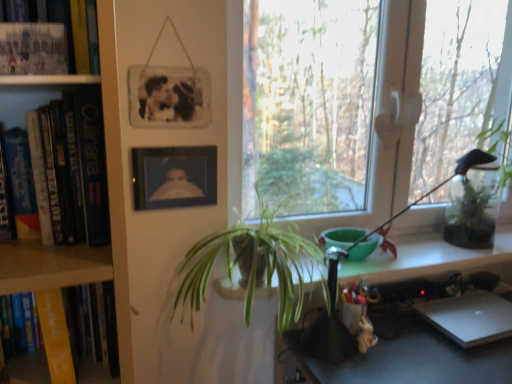
What do you see at coordinates (337, 105) in the screenshot? The width and height of the screenshot is (512, 384). I see `transparent glass window at center` at bounding box center [337, 105].

The width and height of the screenshot is (512, 384). Describe the element at coordinates (70, 28) in the screenshot. I see `matte paper book at upper left, the 1th book in the top-to-bottom sequence` at that location.

Where is `matte paper book at upper left, the 1th book in the top-to-bottom sequence`? The height and width of the screenshot is (384, 512). matte paper book at upper left, the 1th book in the top-to-bottom sequence is located at coordinates (70, 28).

Measure the distance between point (480, 299) and camera.

Point (480, 299) and camera are 5.21 feet apart.

The height and width of the screenshot is (384, 512). What are the coordinates of `green leafy plant at center, positioned as the second houseplant in right-to-left order` in the screenshot? It's located at (252, 264).

In terms of height, does matte black photo frame at upper left, which is counted as the second book, starting from the top, look taller or shorter compared to silver metallic laptop at lower right?

In the image, matte black photo frame at upper left, which is counted as the second book, starting from the top, appears to be taller than silver metallic laptop at lower right.

Considering the sizes of matte black photo frame at upper left, which is counted as the second book, starting from the top, and silver metallic laptop at lower right in the image, is matte black photo frame at upper left, which is counted as the second book, starting from the top, bigger or smaller than silver metallic laptop at lower right?

Clearly, matte black photo frame at upper left, which is counted as the second book, starting from the top, is smaller in size than silver metallic laptop at lower right.

Is matte black photo frame at upper left, which is counted as the second book, starting from the top, wider or thinner than silver metallic laptop at lower right?

Considering their sizes, matte black photo frame at upper left, which is counted as the second book, starting from the top, looks slimmer than silver metallic laptop at lower right.

From the image's perspective, between transparent glass window at center and yellow paperback book at left, the 4th book when ordered from top to bottom, who is located below?

From the image's view, yellow paperback book at left, the 4th book when ordered from top to bottom, is below.

How distant is transparent glass window at center from yellow paperback book at left, the 4th book when ordered from top to bottom?

10.91 feet.

Identify the location of book that is the 3rd one when counting downward from the transparent glass window at center (from the image's perspective). Image resolution: width=512 pixels, height=384 pixels. (81, 347).

Is transparent glass window at center in front of yellow paperback book at left, the 4th book when ordered from top to bottom?

That is False.

In the scene shown: Which object is more forward, matte black photo frame at upper left, which is counted as the second book, starting from the top, or matte black picture frame at upper center, which ranks as the first picture frame in bottom-to-top order?

matte black photo frame at upper left, which is counted as the second book, starting from the top, is in front.

Considering the relative positions of matte black photo frame at upper left, which is counted as the second book, starting from the top, and matte black picture frame at upper center, which is the 2th picture frame in top-to-bottom order, in the image provided, is matte black photo frame at upper left, which is counted as the second book, starting from the top, to the right of matte black picture frame at upper center, which is the 2th picture frame in top-to-bottom order, from the viewer's perspective?

No, matte black photo frame at upper left, which is counted as the second book, starting from the top, is not to the right of matte black picture frame at upper center, which is the 2th picture frame in top-to-bottom order.

How distant is matte black photo frame at upper left, acting as the third book starting from the bottom, from matte black picture frame at upper center, which is the 2th picture frame in top-to-bottom order?

matte black photo frame at upper left, acting as the third book starting from the bottom, is 17.99 inches away from matte black picture frame at upper center, which is the 2th picture frame in top-to-bottom order.

Is point (19, 27) closer to viewer compared to point (189, 192)?

Yes, point (19, 27) is in front of point (189, 192).

Is matte black picture frame at upper center, which ranks as the first picture frame in bottom-to-top order, completely or partially outside of matte black photo frame at upper left, which is counted as the second book, starting from the top?

matte black picture frame at upper center, which ranks as the first picture frame in bottom-to-top order, lies outside matte black photo frame at upper left, which is counted as the second book, starting from the top,'s area.

Is matte black picture frame at upper center, which is the 2th picture frame in top-to-bottom order, bigger than matte black photo frame at upper left, acting as the third book starting from the bottom?

Indeed, matte black picture frame at upper center, which is the 2th picture frame in top-to-bottom order, has a larger size compared to matte black photo frame at upper left, acting as the third book starting from the bottom.

Is matte black picture frame at upper center, which ranks as the first picture frame in bottom-to-top order, looking in the opposite direction of matte black photo frame at upper left, acting as the third book starting from the bottom?

No, matte black photo frame at upper left, acting as the third book starting from the bottom, is not at the back of matte black picture frame at upper center, which ranks as the first picture frame in bottom-to-top order.

Which is more to the left, matte black picture frame at upper center, which is the 2th picture frame in top-to-bottom order, or matte black photo frame at upper left, acting as the third book starting from the bottom?

matte black photo frame at upper left, acting as the third book starting from the bottom, is more to the left.

Is point (152, 94) farther from viewer compared to point (84, 373)?

Yes, it is.

Which is correct: black matte picture frame at upper center, marked as the 2th picture frame in a bottom-to-top arrangement, is inside yellow paperback book at left, the 4th book when ordered from top to bottom, or outside of it?

The correct answer is: outside.

Can you confirm if black matte picture frame at upper center, marked as the 2th picture frame in a bottom-to-top arrangement, is taller than yellow paperback book at left, acting as the 1th book starting from the bottom?

Yes.

This screenshot has width=512, height=384. Identify the location of the 3rd book positioned below the transparent glass window at center (from the image's perspective). click(x=81, y=347).

Does yellow paperback book at left, acting as the 1th book starting from the bottom, have a larger size compared to transparent glass window at center?

No.

Considering the sizes of yellow paperback book at left, acting as the 1th book starting from the bottom, and transparent glass window at center in the image, is yellow paperback book at left, acting as the 1th book starting from the bottom, wider or thinner than transparent glass window at center?

Clearly, yellow paperback book at left, acting as the 1th book starting from the bottom, has more width compared to transparent glass window at center.

How many degrees apart are the facing directions of yellow paperback book at left, the 4th book when ordered from top to bottom, and transparent glass window at center?

0.135 degrees.

From a real-world perspective, which object rests below the other?

green leafy plant at right, which is the 1th houseplant from back to front, from a real-world perspective.

Is point (451, 197) closer to viewer compared to point (71, 5)?

That is False.

Image resolution: width=512 pixels, height=384 pixels. What are the coordinates of `the 1st book in front of the green leafy plant at right, which is the 1th houseplant from back to front, counting from the anchor's position` in the screenshot? It's located at (70, 28).

Is green leafy plant at right, the second houseplant from the front, closer to the viewer compared to matte paper book at upper left, the 4th book from the bottom?

No, green leafy plant at right, the second houseplant from the front, is behind matte paper book at upper left, the 4th book from the bottom.

You are a GUI agent. You are given a task and a screenshot of the screen. Output one action in this format:
    pyautogui.click(x=<x>, y=<y>)
    Task: Click on the 1st book counting from the left side of the silver metallic laptop at lower right
    This screenshot has width=512, height=384.
    Given the screenshot: What is the action you would take?
    pyautogui.click(x=33, y=49)

Find the location of `the 3rd book below the transparent glass window at center (from the image's perspective)`. the 3rd book below the transparent glass window at center (from the image's perspective) is located at coordinates (81, 347).

Estimate the real-world distances between objects in this image. Which object is further from metallic silver desk at lower right, green leafy plant at right, arranged as the 1th houseplant when viewed from the right, or transparent glass window at center?

transparent glass window at center.

Considering their positions, is silver metallic laptop at lower right positioned closer to matte black picture frame at upper center, which is the 2th picture frame in top-to-bottom order, than green leafy plant at right, which is the 1th houseplant from back to front?

silver metallic laptop at lower right is positioned closer to the anchor matte black picture frame at upper center, which is the 2th picture frame in top-to-bottom order.

Based on their spatial positions, is hardcover book at left, acting as the second book starting from the bottom, or green leafy plant at center, which ranks as the first houseplant in left-to-right order, further from transparent glass window at center?

hardcover book at left, acting as the second book starting from the bottom, is positioned further to the anchor transparent glass window at center.

Which object lies further to the anchor point green leafy plant at center, positioned as the second houseplant in right-to-left order, matte black photo frame at upper left, acting as the third book starting from the bottom, or black matte picture frame at upper center, marked as the 2th picture frame in a bottom-to-top arrangement?

matte black photo frame at upper left, acting as the third book starting from the bottom, lies further to green leafy plant at center, positioned as the second houseplant in right-to-left order, than the other object.

Considering their positions, is green leafy plant at center, positioned as the first houseplant in front-to-back order, positioned further to matte black photo frame at upper left, which is counted as the second book, starting from the top, than silver metallic laptop at lower right?

silver metallic laptop at lower right lies further to matte black photo frame at upper left, which is counted as the second book, starting from the top, than the other object.

Based on the photo, considering their positions, is green leafy plant at center, positioned as the second houseplant in right-to-left order, positioned closer to matte black photo frame at upper left, which is counted as the second book, starting from the top, than metallic silver desk at lower right?

The object closer to matte black photo frame at upper left, which is counted as the second book, starting from the top, is green leafy plant at center, positioned as the second houseplant in right-to-left order.

From the picture: Based on their spatial positions, is transparent glass window at center or yellow paperback book at left, acting as the 1th book starting from the bottom, further from black matte picture frame at upper center, marked as the 2th picture frame in a bottom-to-top arrangement?

The object further to black matte picture frame at upper center, marked as the 2th picture frame in a bottom-to-top arrangement, is transparent glass window at center.

From the image, which object appears to be nearer to matte paper book at upper left, the 4th book from the bottom, green leafy plant at right, which is the 1th houseplant from back to front, or transparent glass window at center?

green leafy plant at right, which is the 1th houseplant from back to front, lies closer to matte paper book at upper left, the 4th book from the bottom, than the other object.

Find the location of a particular element. book situated between matte paper book at upper left, the 4th book from the bottom, and transparent glass window at center from left to right is located at coordinates (33, 49).

Identify the location of laptop located between hardcover book at left, which ranks as the third book in top-to-bottom order, and green leafy plant at right, which is the 1th houseplant from back to front, in the left-right direction. This screenshot has height=384, width=512. (470, 317).

This screenshot has width=512, height=384. What are the coordinates of `houseplant located between hardcover book at left, acting as the second book starting from the bottom, and green leafy plant at right, the second houseplant from the left, in the left-right direction` in the screenshot? It's located at (252, 264).

Where is `houseplant between yellow paperback book at left, the 4th book when ordered from top to bottom, and silver metallic laptop at lower right`? houseplant between yellow paperback book at left, the 4th book when ordered from top to bottom, and silver metallic laptop at lower right is located at coordinates (252, 264).